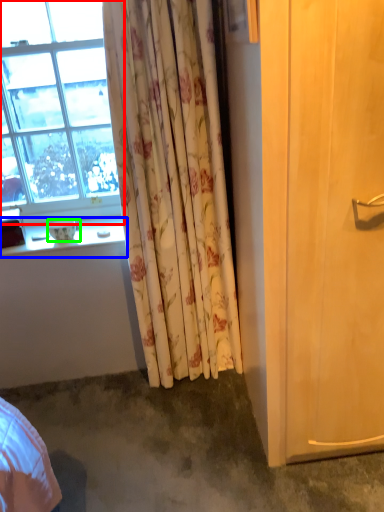
Question: Which is nearer to the window (highlighted by a red box)? window sill (highlighted by a blue box) or bowl (highlighted by a green box).

Choices:
 (A) window sill
 (B) bowl

Answer: (A)